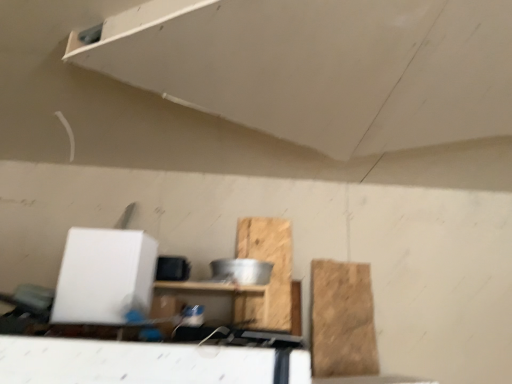
Question: Which is correct: white matte exhaust hood at upper center is inside wooden at center, which is counted as the second cardboard, starting from the right, or outside of it?

Choices:
 (A) inside
 (B) outside

Answer: (B)

Question: Considering the positions of white matte exhaust hood at upper center and wooden at center, which is counted as the second cardboard, starting from the right, in the image, is white matte exhaust hood at upper center taller or shorter than wooden at center, which is counted as the second cardboard, starting from the right,?

Choices:
 (A) tall
 (B) short

Answer: (B)

Question: Which of these objects is positioned farthest from the white matte exhaust hood at upper center?

Choices:
 (A) wooden shelf at center
 (B) wooden at center, which appears as the 1th cardboard when viewed from the left
 (C) brown cardboard at right, which appears as the second cardboard when viewed from the left

Answer: (C)

Question: Estimate the real-world distances between objects in this image. Which object is closer to the wooden at center, which appears as the 1th cardboard when viewed from the left?

Choices:
 (A) brown cardboard at right, which is counted as the 1th cardboard, starting from the right
 (B) white matte exhaust hood at upper center
 (C) wooden shelf at center

Answer: (A)